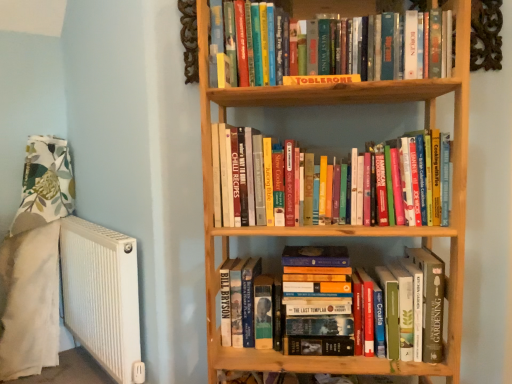
Question: Should I look upward or downward to see white ribbed radiator at left?

Choices:
 (A) up
 (B) down

Answer: (B)

Question: Is hardcover books at lower center, which is the third book from top to bottom, at the right side of yellow cardboard toblerone at upper center, which is the 1th book in top-to-bottom order?

Choices:
 (A) no
 (B) yes

Answer: (B)

Question: From a real-world perspective, is hardcover books at lower center, which is the first book in bottom-to-top order, under yellow cardboard toblerone at upper center, which is the 3th book from bottom to top?

Choices:
 (A) yes
 (B) no

Answer: (A)

Question: Is hardcover books at lower center, which is the third book from top to bottom, turned away from yellow cardboard toblerone at upper center, which is the 1th book in top-to-bottom order?

Choices:
 (A) yes
 (B) no

Answer: (B)

Question: From a real-world perspective, is hardcover books at lower center, which is the first book in bottom-to-top order, over yellow cardboard toblerone at upper center, which is the 1th book in top-to-bottom order?

Choices:
 (A) yes
 (B) no

Answer: (B)

Question: Can you confirm if hardcover books at lower center, which is the first book in bottom-to-top order, is smaller than yellow cardboard toblerone at upper center, which is the 1th book in top-to-bottom order?

Choices:
 (A) no
 (B) yes

Answer: (A)

Question: Is hardcover books at lower center, which is the first book in bottom-to-top order, not within yellow cardboard toblerone at upper center, which is the 3th book from bottom to top?

Choices:
 (A) no
 (B) yes

Answer: (B)

Question: Is yellow cardboard toblerone at upper center, which is the 3th book from bottom to top, closer to camera compared to white ribbed radiator at left?

Choices:
 (A) no
 (B) yes

Answer: (B)

Question: Is yellow cardboard toblerone at upper center, which is the 3th book from bottom to top, looking in the opposite direction of white ribbed radiator at left?

Choices:
 (A) no
 (B) yes

Answer: (A)

Question: Is yellow cardboard toblerone at upper center, which is the 1th book in top-to-bottom order, outside white ribbed radiator at left?

Choices:
 (A) no
 (B) yes

Answer: (B)

Question: Would you consider yellow cardboard toblerone at upper center, which is the 1th book in top-to-bottom order, to be distant from white ribbed radiator at left?

Choices:
 (A) yes
 (B) no

Answer: (A)

Question: Considering the relative sizes of yellow cardboard toblerone at upper center, which is the 3th book from bottom to top, and white ribbed radiator at left in the image provided, is yellow cardboard toblerone at upper center, which is the 3th book from bottom to top, wider than white ribbed radiator at left?

Choices:
 (A) no
 (B) yes

Answer: (B)

Question: Considering the relative positions of yellow cardboard toblerone at upper center, which is the 1th book in top-to-bottom order, and white ribbed radiator at left in the image provided, is yellow cardboard toblerone at upper center, which is the 1th book in top-to-bottom order, to the left of white ribbed radiator at left from the viewer's perspective?

Choices:
 (A) no
 (B) yes

Answer: (A)

Question: Is hardcover books at center, arranged as the 2th book when ordered from the bottom, not inside hardcover books at lower center, which is the third book from top to bottom?

Choices:
 (A) no
 (B) yes

Answer: (B)